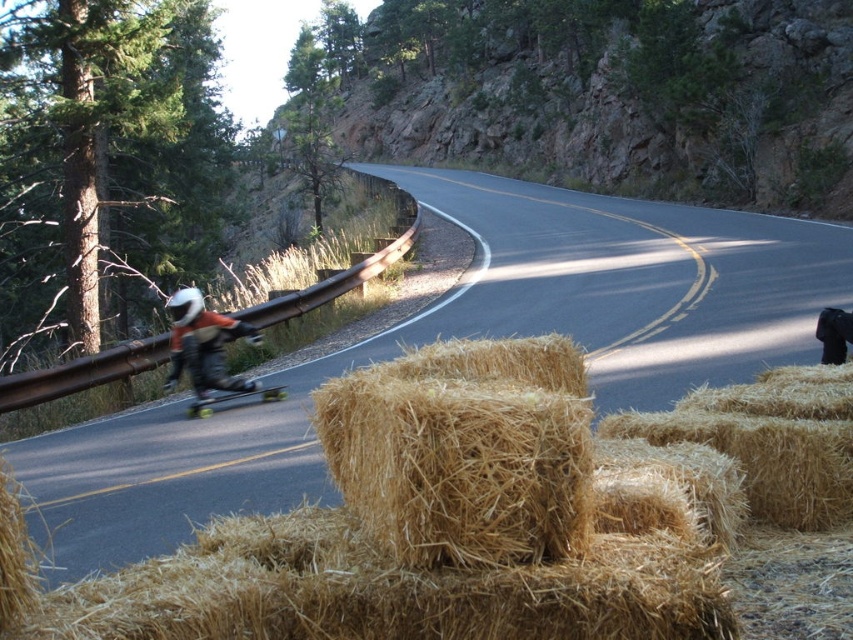
You are standing on the curving mountain road and want to roll the smooth black skateboard at left towards the golden straw bale at center. Will the skateboard move towards the bale if you push it?

The golden straw bale at center is in front of the smooth black skateboard at left, so pushing the skateboard would move it towards the bale since it is positioned ahead of the skateboard.

You are a photographer standing at the camera position. You want to retrieve your matte black helmet at left to protect yourself from the sun. Can you walk directly to it without moving any objects?

The matte black helmet at left and camera are 11.43 meters apart. Since there are no objects mentioned between them, you can walk directly to the matte black helmet at left without moving anything.